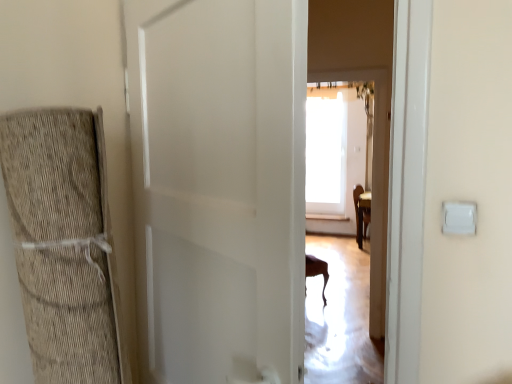
This screenshot has width=512, height=384. Identify the location of white matte door at center. (219, 187).

Image resolution: width=512 pixels, height=384 pixels. Describe the element at coordinates (219, 187) in the screenshot. I see `white matte door at center` at that location.

The width and height of the screenshot is (512, 384). I want to click on white plastic light switch at right, so click(x=459, y=218).

Describe the element at coordinates (459, 218) in the screenshot. The width and height of the screenshot is (512, 384). I see `white plastic light switch at right` at that location.

The height and width of the screenshot is (384, 512). What are the coordinates of `white matte door at center` in the screenshot? It's located at (219, 187).

In the image, is white matte door at center on the left side or the right side of white plastic light switch at right?

white matte door at center is positioned on white plastic light switch at right's left side.

In the image, is white matte door at center positioned in front of or behind white plastic light switch at right?

In the image, white matte door at center appears in front of white plastic light switch at right.

Does point (167, 128) come in front of point (450, 221)?

That is False.

From the image's perspective, which is above, white matte door at center or white plastic light switch at right?

white plastic light switch at right.

From a real-world perspective, is white matte door at center positioned above or below white plastic light switch at right?

Clearly, from a real-world perspective, white matte door at center is below white plastic light switch at right.

From the picture: Is white matte door at center wider or thinner than white plastic light switch at right?

In the image, white matte door at center appears to be wider than white plastic light switch at right.

Can you confirm if white matte door at center is taller than white plastic light switch at right?

Correct, white matte door at center is much taller as white plastic light switch at right.

Between white matte door at center and white plastic light switch at right, which one has larger size?

With larger size is white matte door at center.

Is white matte door at center situated inside white plastic light switch at right or outside?

white matte door at center is not inside white plastic light switch at right, it's outside.

Is white matte door at center far from white plastic light switch at right?

white matte door at center is actually quite close to white plastic light switch at right.

Is white matte door at center facing away from white plastic light switch at right?

No, white plastic light switch at right is not at the back of white matte door at center.

The height and width of the screenshot is (384, 512). In order to click on light switch to the right of white matte door at center in this screenshot , I will do 459,218.

In the image, is white plastic light switch at right on the left side or the right side of white matte door at center?

Based on their positions, white plastic light switch at right is located to the right of white matte door at center.

Which is in front, white plastic light switch at right or white matte door at center?

white matte door at center is closer to the camera.

Which is closer to the camera, (471,207) or (142,272)?

The point (471,207) is more forward.

From the image's perspective, is white plastic light switch at right beneath white matte door at center?

No, from the image's perspective, white plastic light switch at right is not below white matte door at center.

From a real-world perspective, which is physically below, white plastic light switch at right or white matte door at center?

In real-world perspective, white matte door at center is lower.

Considering the relative sizes of white plastic light switch at right and white matte door at center in the image provided, is white plastic light switch at right wider than white matte door at center?

Incorrect, the width of white plastic light switch at right does not surpass that of white matte door at center.

Considering the sizes of objects white plastic light switch at right and white matte door at center in the image provided, who is shorter, white plastic light switch at right or white matte door at center?

Standing shorter between the two is white plastic light switch at right.

Considering the sizes of white plastic light switch at right and white matte door at center in the image, is white plastic light switch at right bigger or smaller than white matte door at center?

Considering their sizes, white plastic light switch at right takes up less space than white matte door at center.

Is white matte door at center inside white plastic light switch at right?

Result: No, white matte door at center is not surrounded by white plastic light switch at right.

Is white plastic light switch at right not close to white matte door at center?

No, white plastic light switch at right is not far away from white matte door at center.

Is white plastic light switch at right turned away from white matte door at center?

white plastic light switch at right is not turned away from white matte door at center.

Can you tell me how much white plastic light switch at right and white matte door at center differ in facing direction?

white plastic light switch at right and white matte door at center are facing 142 degrees away from each other.

Locate an element on the screen. This screenshot has width=512, height=384. light switch above the white matte door at center (from a real-world perspective) is located at coordinates (459, 218).

Locate an element on the screen. This screenshot has width=512, height=384. door in front of the white plastic light switch at right is located at coordinates (219, 187).

This screenshot has width=512, height=384. In the image, there is a white matte door at center. What are the coordinates of `light switch above it (from the image's perspective)` in the screenshot? It's located at (459, 218).